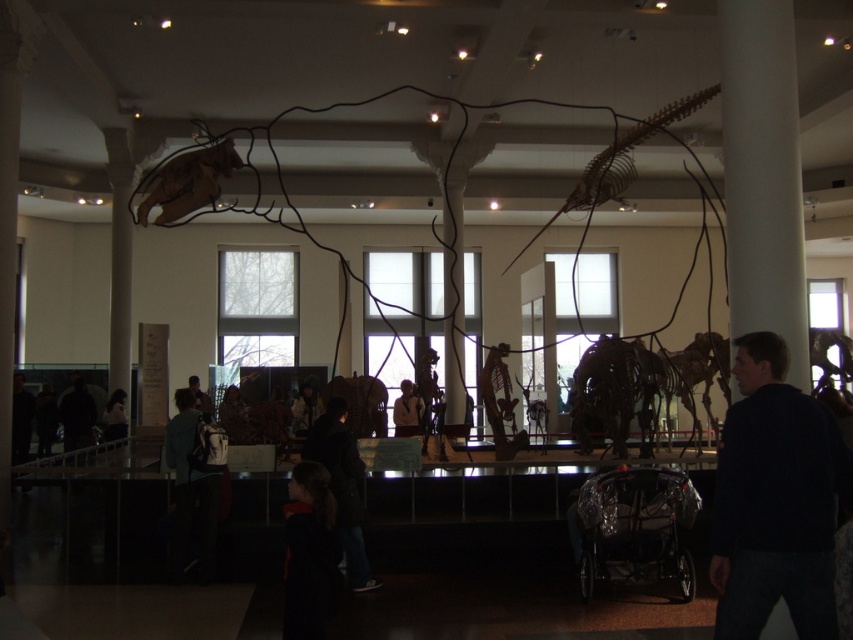
Locate an element on the screen. dark blue jacket at left is located at coordinates (21, 419).

I want to click on dark blue jacket at left, so click(21, 419).

Is dark blue sweater at right above dark blue jacket at lower left?

Yes.

Measure the distance between dark blue sweater at right and camera.

dark blue sweater at right is 3.27 meters from camera.

Who is more forward, (732, 579) or (120, 435)?

Point (732, 579)

Where is `dark blue sweater at right`? This screenshot has height=640, width=853. dark blue sweater at right is located at coordinates (775, 499).

In the scene shown: Between light brown leather jacket at center and white fabric coat at center, which one is positioned higher?

white fabric coat at center

Is light brown leather jacket at center bigger than white fabric coat at center?

No, light brown leather jacket at center is not bigger than white fabric coat at center.

I want to click on light brown leather jacket at center, so click(407, 410).